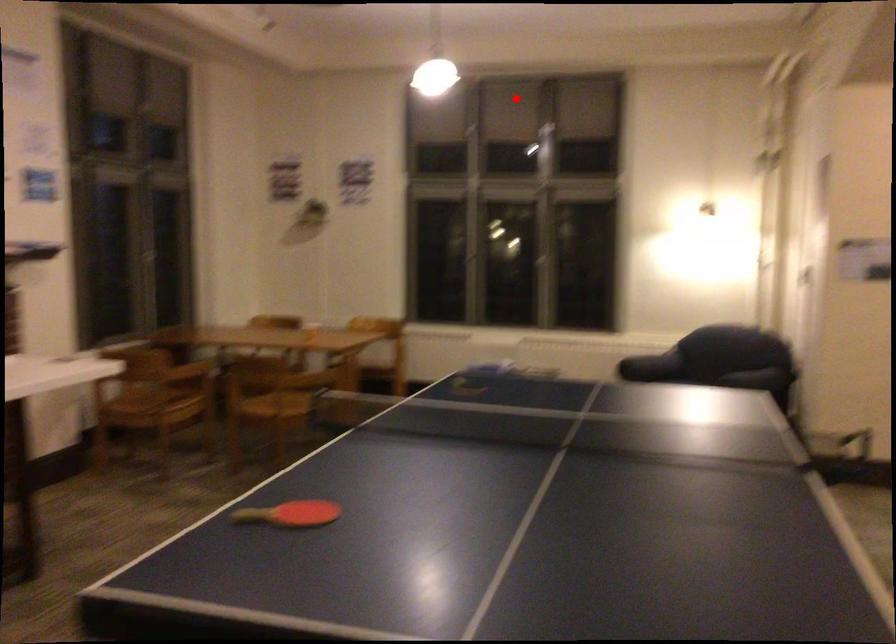
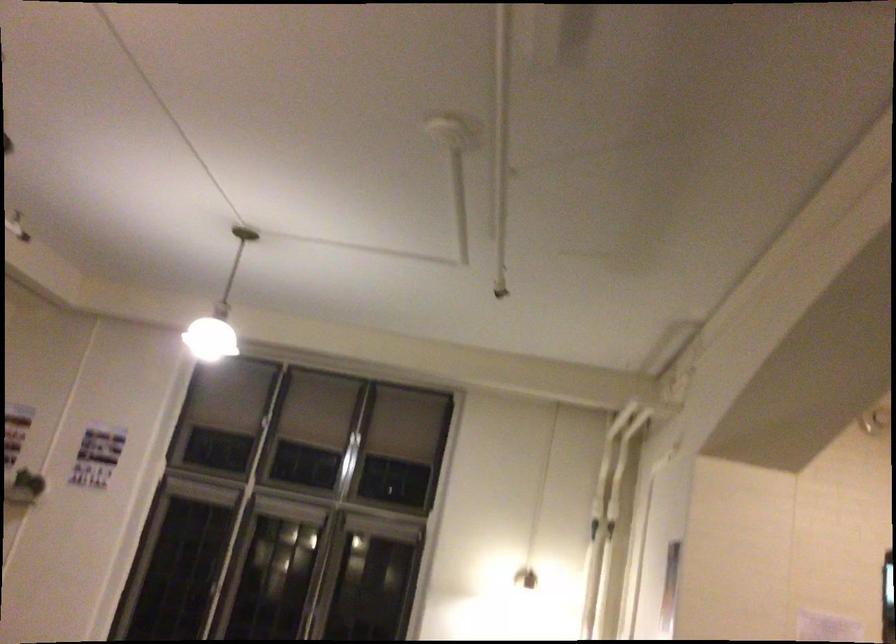
Locate, in the second image, the point that corresponds to the highlighted location in the first image.

(355, 437)